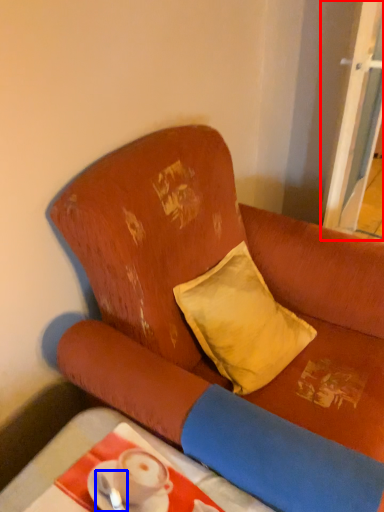
Question: Which object is closer to the camera taking this photo, screen door (highlighted by a red box) or tableware (highlighted by a blue box)?

Choices:
 (A) screen door
 (B) tableware

Answer: (B)